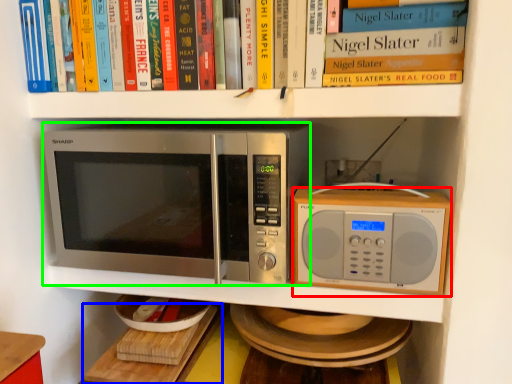
Question: Estimate the real-world distances between objects in this image. Which object is closer to microwave oven (highlighted by a red box), table (highlighted by a blue box) or microwave oven (highlighted by a green box)?

Choices:
 (A) table
 (B) microwave oven

Answer: (B)